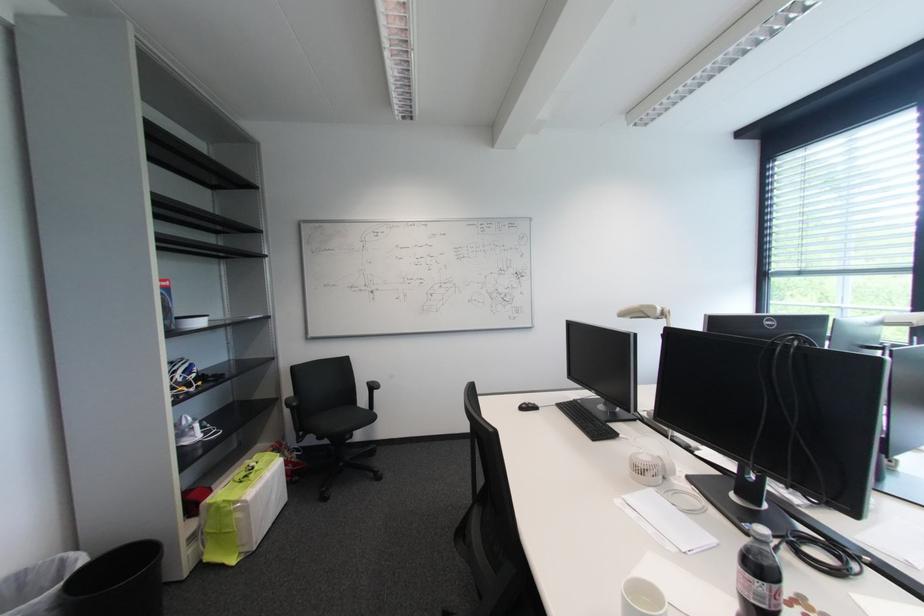
Where would you lift the white mug? Please return your answer as a coordinate pair (x, y).

(641, 598)